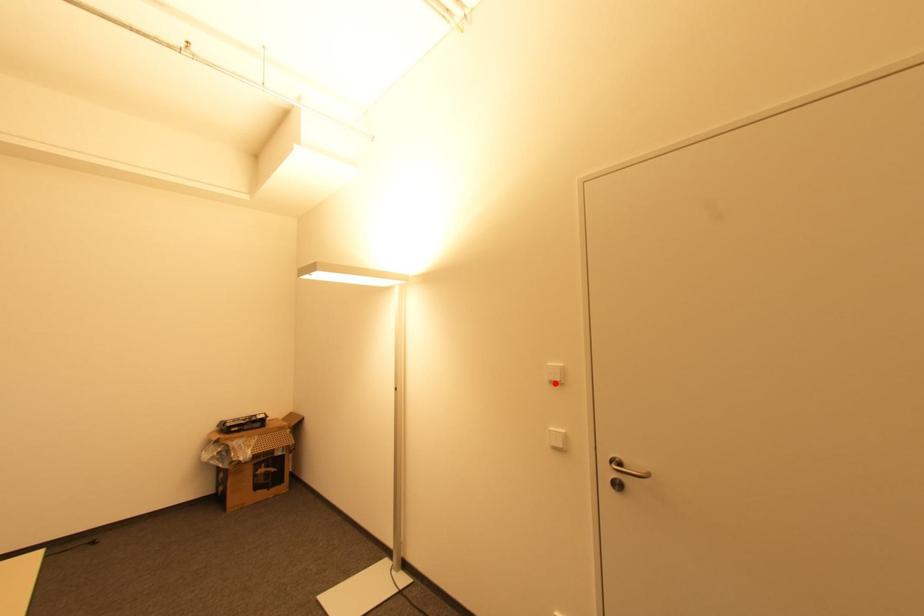
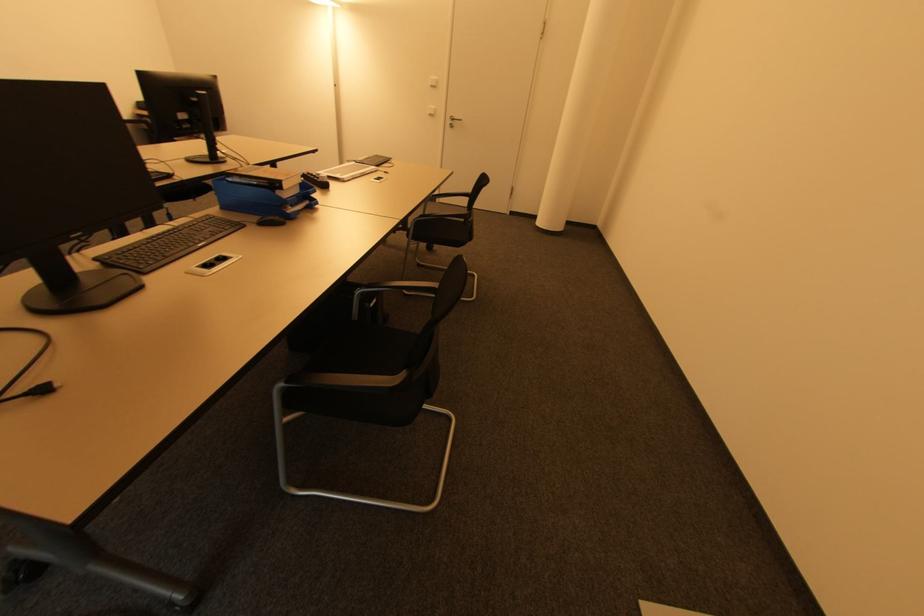
The point at the highlighted location is marked in the first image. Where is the corresponding point in the second image?

(434, 87)